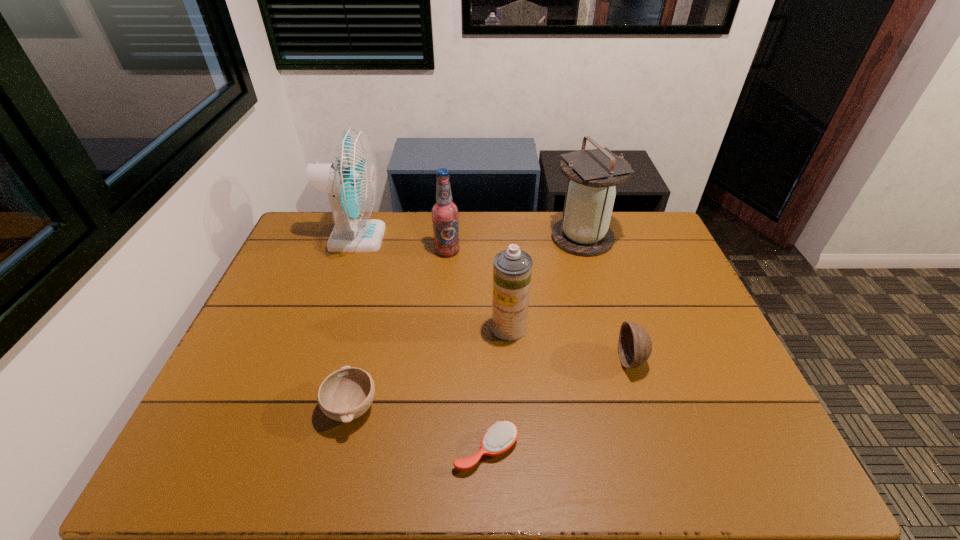
Locate an element on the screen. The height and width of the screenshot is (540, 960). vacant area between the aerosol can and the fan is located at coordinates (433, 283).

Find the location of a particular element. Image resolution: width=960 pixels, height=540 pixels. vacant area that lies between the left bowl and the alcohol is located at coordinates tap(399, 329).

Locate an element on the screen. vacant area between the lantern and the right bowl is located at coordinates (607, 299).

You are a GUI agent. You are given a task and a screenshot of the screen. Output one action in this format:
    pyautogui.click(x=<x>, y=<y>)
    Task: Click on the vacant area that lies between the hairbrush and the aerosol can
    
    Given the screenshot: What is the action you would take?
    click(x=497, y=389)

Where is `empty location between the sixth tallest object and the hairbrush`? This screenshot has width=960, height=540. empty location between the sixth tallest object and the hairbrush is located at coordinates (420, 428).

Find the location of `vacant area that lies between the lantern and the fan`. vacant area that lies between the lantern and the fan is located at coordinates (469, 238).

Find the location of a particular element. Image resolution: width=960 pixels, height=540 pixels. the fourth closest object relative to the alcohol is located at coordinates (346, 394).

This screenshot has width=960, height=540. What are the coordinates of `object that ranks as the fourth closest to the fan` in the screenshot? It's located at (584, 230).

Find the location of a particular element. Image resolution: width=960 pixels, height=540 pixels. free space that satisfies the following two spatial constraints: 1. on the back side of the hairbrush; 2. on the right side of the right bowl is located at coordinates (486, 360).

The width and height of the screenshot is (960, 540). Identify the location of vacant space that satisfies the following two spatial constraints: 1. on the back side of the aerosol can; 2. on the left side of the lantern. (503, 238).